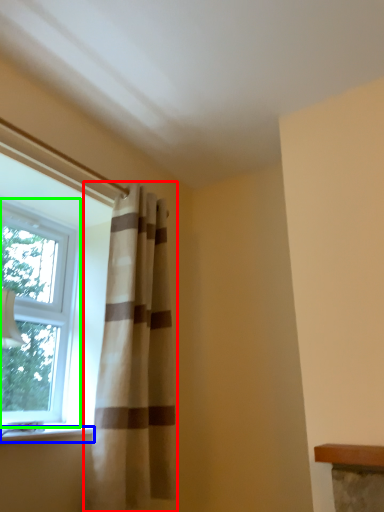
Question: Considering the real-world distances, which object is farthest from curtain (highlighted by a red box)? window sill (highlighted by a blue box) or window (highlighted by a green box)?

Choices:
 (A) window sill
 (B) window

Answer: (B)